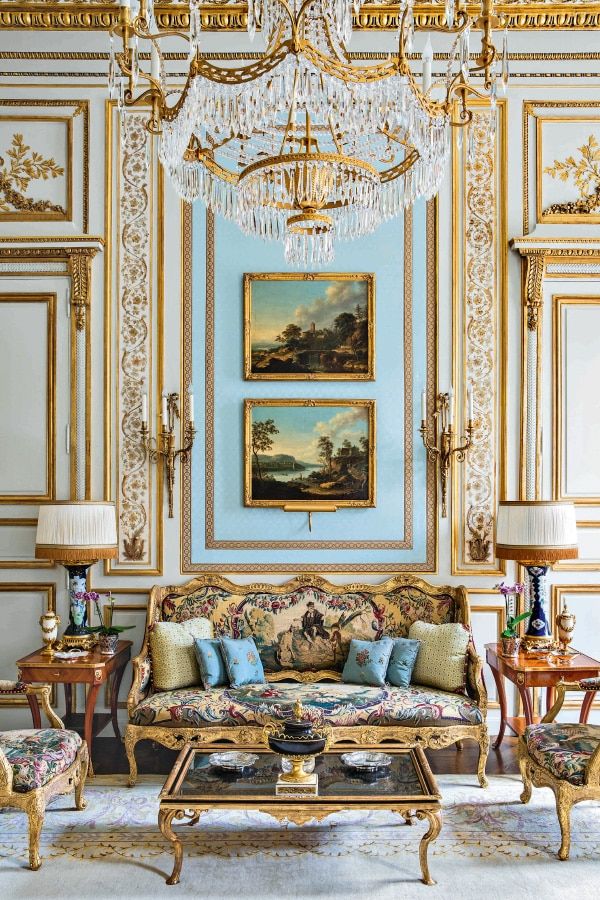
The image size is (600, 900). I want to click on chandelier, so click(x=306, y=159).